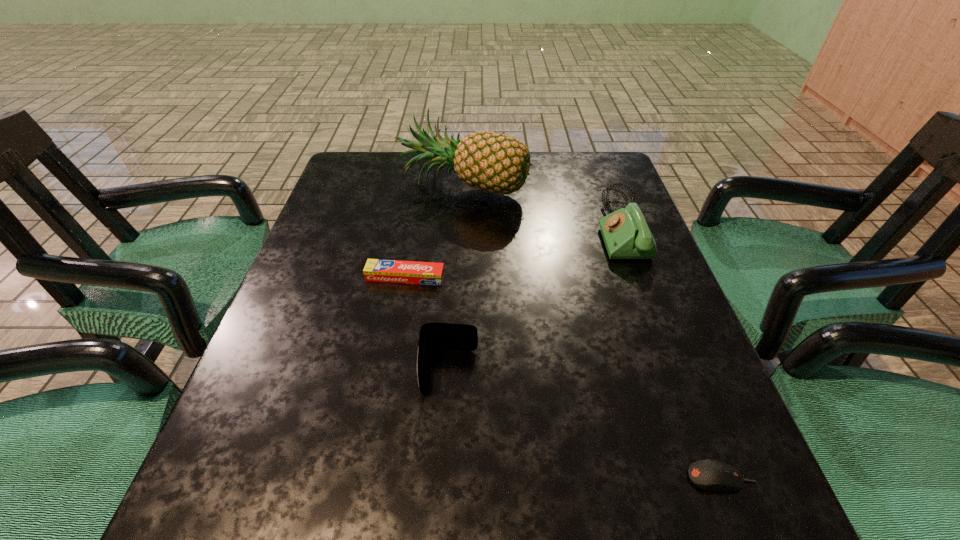
The height and width of the screenshot is (540, 960). What are the coordinates of `pineapple` in the screenshot? It's located at (492, 162).

Where is `telephone`? telephone is located at coordinates (626, 235).

Locate an element on the screen. the second nearest object is located at coordinates (433, 336).

Find the location of a particular element. The image size is (960, 540). toothpaste is located at coordinates pyautogui.click(x=395, y=271).

What are the coordinates of `computer mouse` in the screenshot? It's located at (709, 475).

At what (x,y) coordinates should I click in order to perform the action: click on vacant space situated on the right of the pineapple. Please return your answer as a coordinate pair (x, y). The height and width of the screenshot is (540, 960). Looking at the image, I should click on (572, 185).

Find the location of a particular element. This screenshot has height=540, width=960. free location located 0.080m on the dial of the telephone is located at coordinates 564,226.

Where is `free space located 0.370m on the dial of the telephone`? free space located 0.370m on the dial of the telephone is located at coordinates (444, 226).

This screenshot has height=540, width=960. Identify the location of vacant region located on the dial of the telephone. (457, 226).

This screenshot has height=540, width=960. Find the location of `vacant region located on the outer surface of the second nearest object`. vacant region located on the outer surface of the second nearest object is located at coordinates (440, 529).